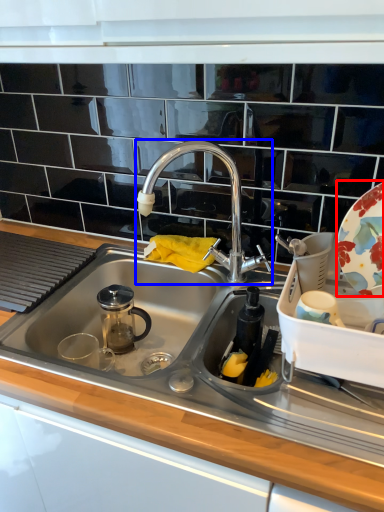
Question: Which of the following is the closest to the observer, platter (highlighted by a red box) or tap (highlighted by a blue box)?

Choices:
 (A) platter
 (B) tap

Answer: (A)